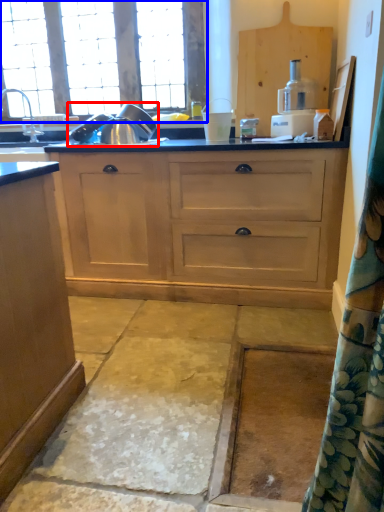
Question: Which of the following is the farthest to the observer, appliance (highlighted by a red box) or window (highlighted by a blue box)?

Choices:
 (A) appliance
 (B) window

Answer: (B)